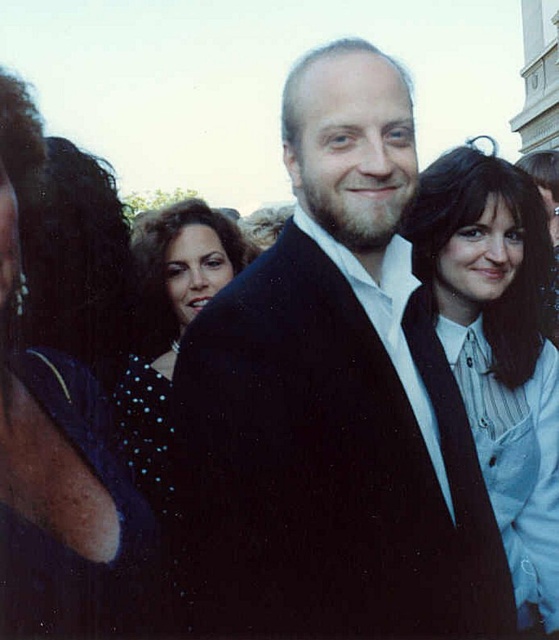
You are organizing a photo shoot and need to ensure that the dark blue dotted dress at left and the light blue shirt at center are visible in the frame. Based on their sizes, which clothing item takes up more space in the image?

The dark blue dotted dress at left has a greater width than the light blue shirt at center, so it takes up more space in the image.

You are a photographer trying to capture a group photo. You have two subjects wearing the light blue shirt at center and the sparkly blue dress at center. Which subject should you focus on if you want to ensure the one with the larger width is in the frame?

You should focus on the light blue shirt at center because its width is larger than the sparkly blue dress at center.